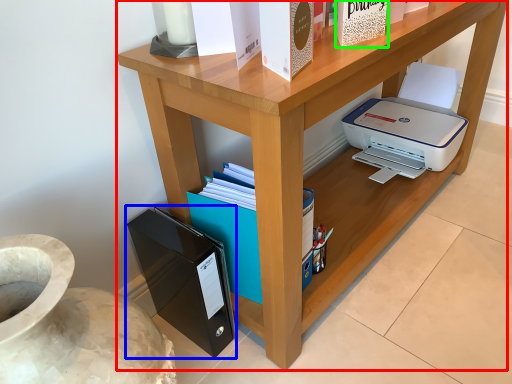
Question: Estimate the real-world distances between objects in this image. Which object is farther from desk (highlighted by a red box), paperback book (highlighted by a blue box) or paperback book (highlighted by a green box)?

Choices:
 (A) paperback book
 (B) paperback book

Answer: (B)